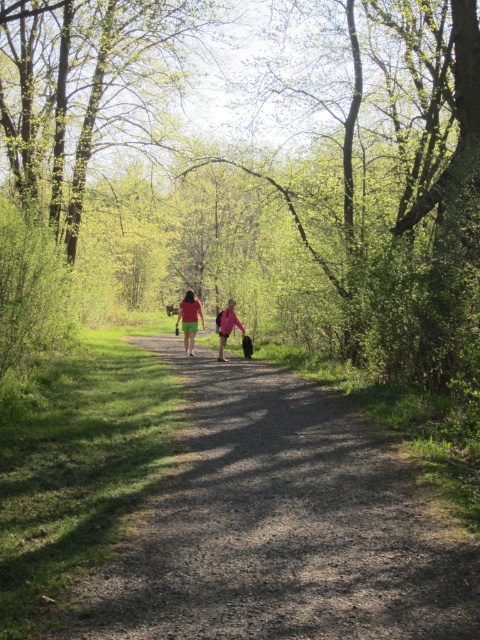
You are a hiker trying to decide which direction to go next. You see two people ahead on the path. The person in the green fabric shirt at center and the person in the matte pink jacket at center. Which one is taller?

The green fabric shirt at center is taller than the matte pink jacket at center.

You are a hiker trying to follow the dirt path at center in the forest. There is a green leafy tree at center blocking your view ahead. Which direction should you walk to stay on the path and avoid the tree?

The green leafy tree at center is to the left of the dirt path at center, so you should walk to the right of the tree to stay on the path and avoid it.

You are a hiker trying to take a photo of both the green fabric shirt at center and the matte pink jacket at center from the path. Which one should you focus on first to ensure both are in the frame?

The green fabric shirt at center is positioned over the matte pink jacket at center, so you should focus on the matte pink jacket at center first to ensure both are in the frame.